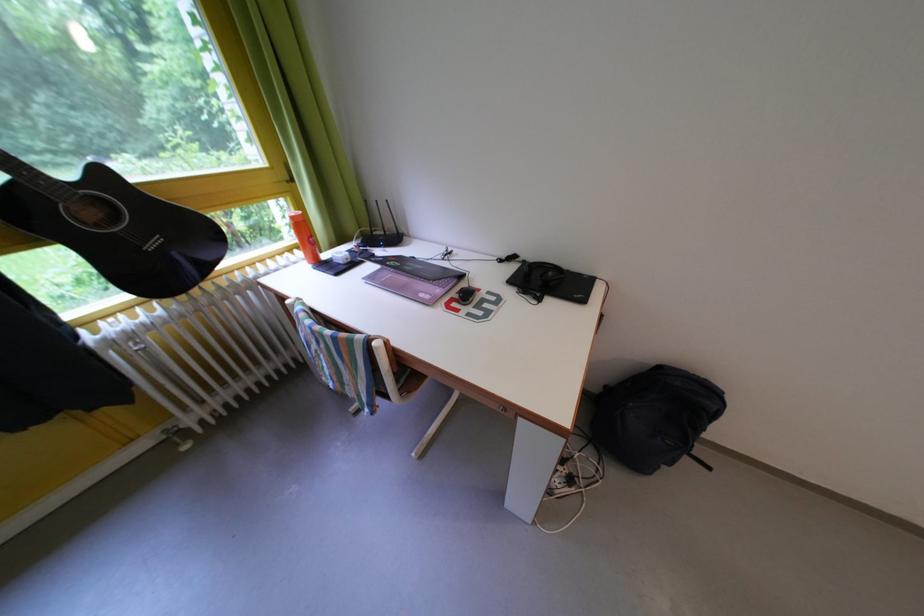
The width and height of the screenshot is (924, 616). I want to click on black backpack, so click(x=654, y=416).